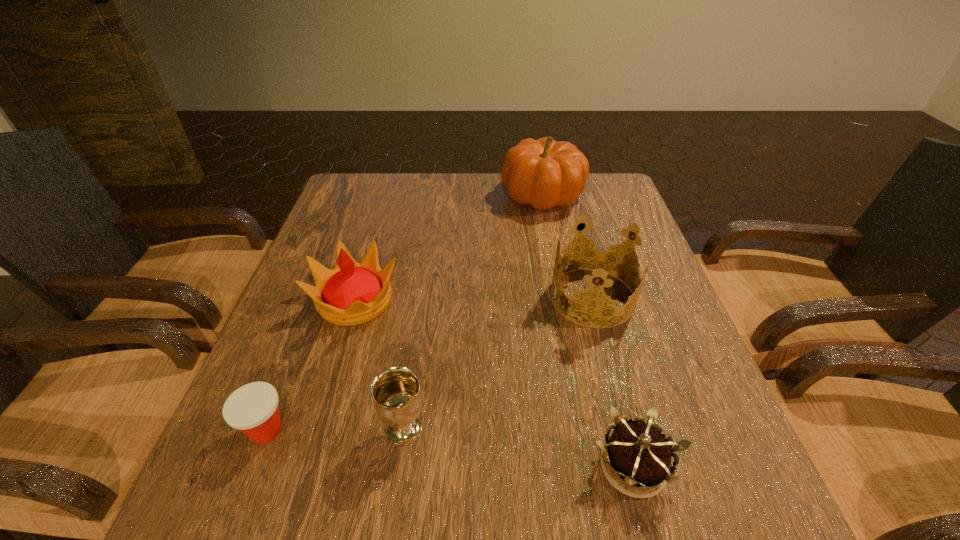
Identify the location of vacant space located on the right of the Dixie cup. Image resolution: width=960 pixels, height=540 pixels. (394, 430).

Where is `object at the far edge`? object at the far edge is located at coordinates (544, 173).

Image resolution: width=960 pixels, height=540 pixels. Identify the location of object that is at the near edge. (635, 453).

Locate an element on the screen. crown located in the left edge section of the desktop is located at coordinates (352, 293).

Where is `Dixie cup that is positioned at the left edge`? Image resolution: width=960 pixels, height=540 pixels. Dixie cup that is positioned at the left edge is located at coordinates [x=253, y=409].

Where is `pumpkin located at the right edge`? pumpkin located at the right edge is located at coordinates (544, 173).

The image size is (960, 540). I want to click on object that is at the far right corner, so click(x=544, y=173).

Where is `object that is at the near right corner`? Image resolution: width=960 pixels, height=540 pixels. object that is at the near right corner is located at coordinates (635, 453).

The image size is (960, 540). In the image, there is a desktop. What are the coordinates of `vacant space at the far edge` in the screenshot? It's located at (412, 174).

This screenshot has height=540, width=960. Find the location of `free space at the near edge`. free space at the near edge is located at coordinates (562, 490).